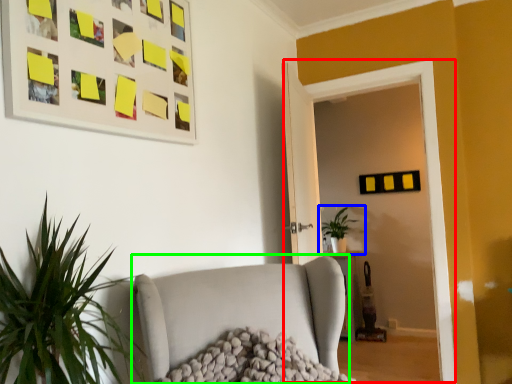
Question: Based on their relative distances, which object is farther from glass door (highlighted by a red box)? Choose from houseplant (highlighted by a blue box) and studio couch (highlighted by a green box).

Choices:
 (A) houseplant
 (B) studio couch

Answer: (A)